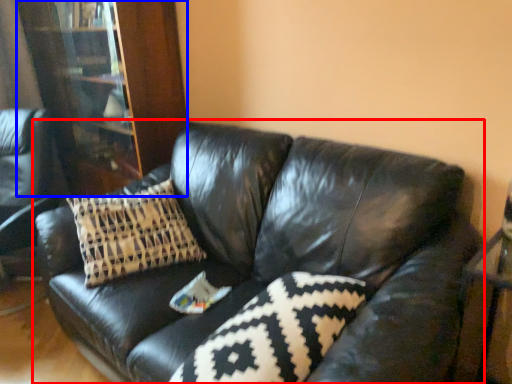
Question: Which object is further to the camera taking this photo, studio couch (highlighted by a red box) or bookcase (highlighted by a blue box)?

Choices:
 (A) studio couch
 (B) bookcase

Answer: (B)